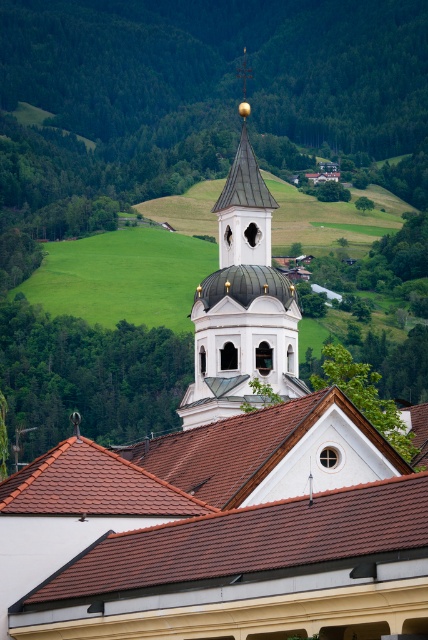
You are standing in the middle of the scene and notice two structures in front of you. The first is the brown tile roof at center and the second is the white glossy bell tower at center. Which one is positioned to the left when facing the scene?

The brown tile roof at center is to the left of the white glossy bell tower at center, so when facing the scene, the brown tile roof at center is positioned to the left.

You are standing in the middle of the scene and want to take a photo of both the brown tile roof at center and the white glossy bell tower at center. Which object should you focus on first if you want to capture both in the same frame without moving the camera?

The brown tile roof at center is shorter than the white glossy bell tower at center, so you should focus on the white glossy bell tower at center first to ensure both are in the frame.

You are standing in the rural area near the church steeple and want to determine the relative positions of two points marked in the image. Which point, point 1 at coordinates (300, 556) or point 2 at coordinates (214, 304), is closer to you?

Point 1 at coordinates (300, 556) is closer to the viewer than point 2 at coordinates (214, 304).